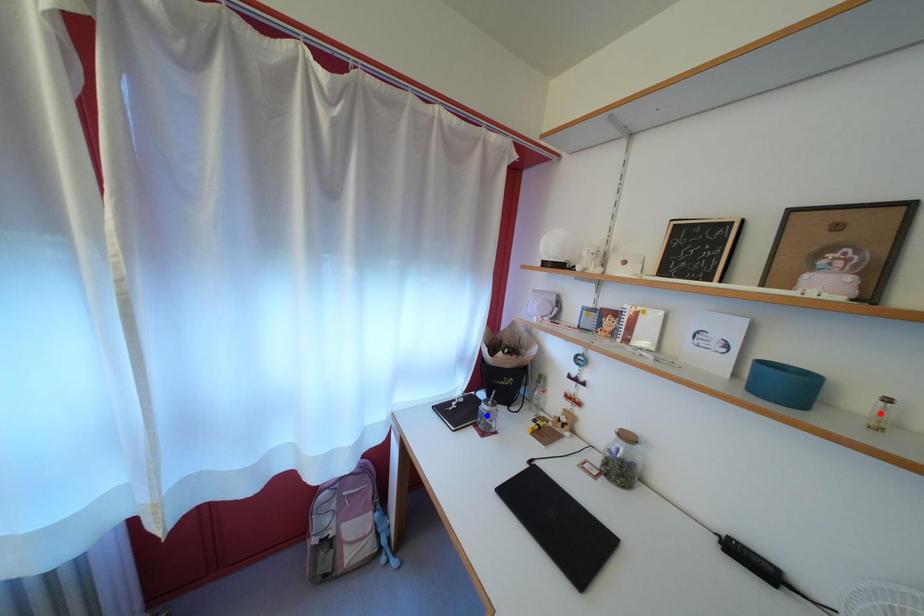
Question: Which of the two points in the image is closer to the camera?

Choices:
 (A) Blue point is closer.
 (B) Red point is closer.

Answer: (B)